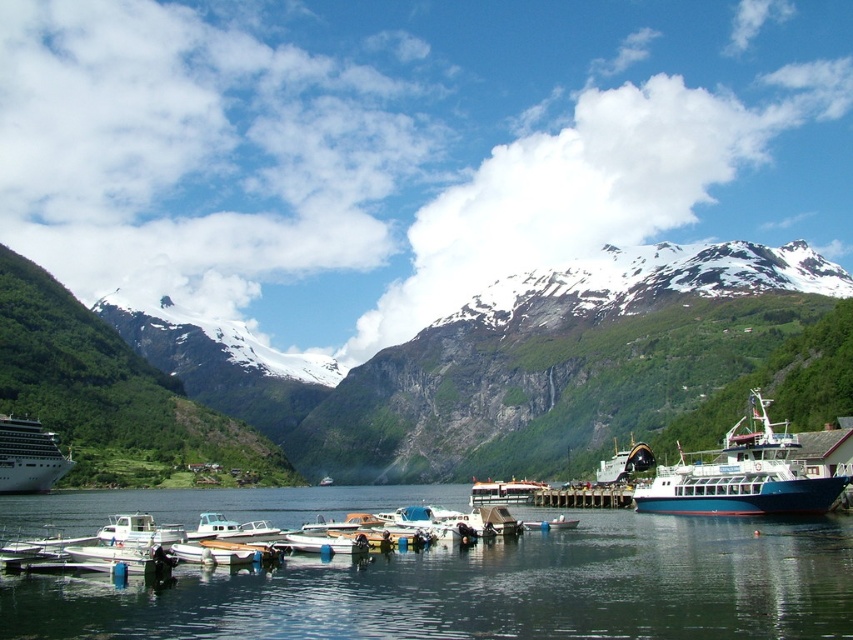
You are a photographer standing at the edge of the fjord and want to capture the blue matte boat at lower right in your shot. Based on the distance provided, will the boat appear large or small in the photo?

The blue matte boat at lower right is 176.03 meters away from the camera. Since it is quite far, it will appear small in the photo.

Consider the image. You are standing at the edge of the fjord and want to reach a specific point marked at coordinates point (514, 372). Given that you can walk at a speed of 3 feet per second, how many seconds will it take you to reach that point?

The distance of point (514, 372) from viewer is 1579.89 feet. At a walking speed of 3 feet per second, it will take 1579.89 divided by 3, which is approximately 526.63 seconds to reach the point.